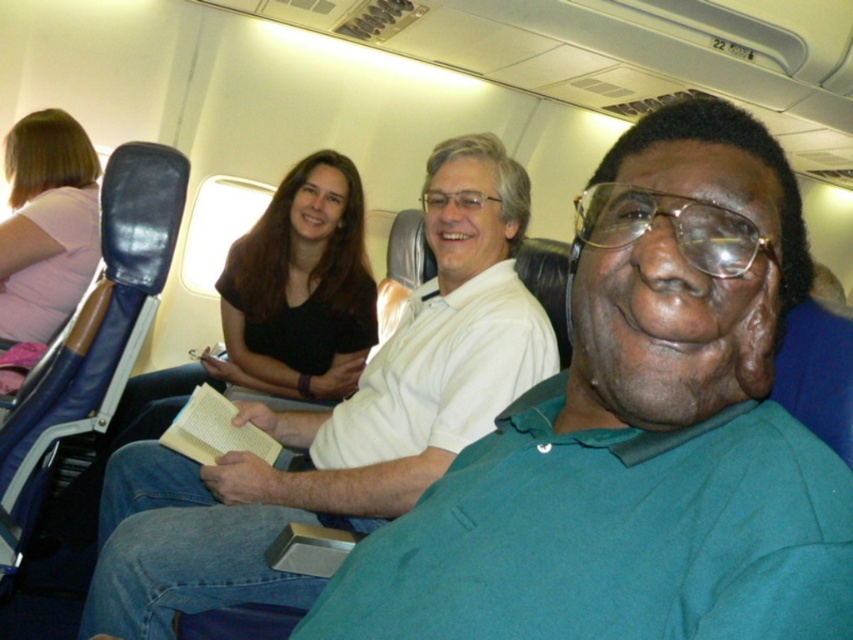
Looking at this image, you are a flight attendant and need to locate the passenger wearing the green matte shirt at center. According to the coordinates provided, where exactly should you look?

The green matte shirt at center is located at point (x=637, y=433).

You are a flight attendant and need to hand out a safety pamphlet to the passengers. The green matte shirt at center and white matte shirt at center are both in your line of sight. Which passenger should you hand the pamphlet to first if you follow the airline protocol of serving from front to back?

The green matte shirt at center should be served first because it is positioned over the white matte shirt at center, indicating it is closer to the front of the cabin.

You are seated at point (340,474) and want to reach the overhead compartment located at point (366,552). Can you easily access it without moving your seat?

Point (366,552) is in front of point (340,474). Since the overhead compartment is located in front of your seat, you can easily access it without needing to move your seat.